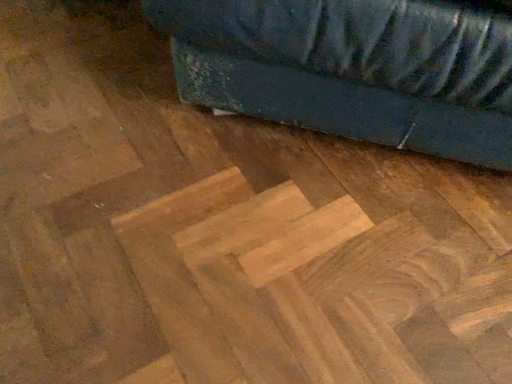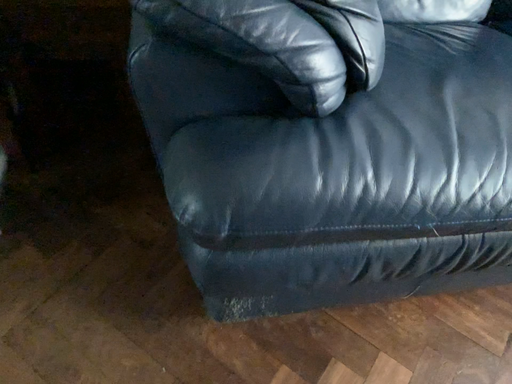
Question: Which way did the camera rotate in the video?

Choices:
 (A) rotated upward
 (B) rotated downward

Answer: (A)